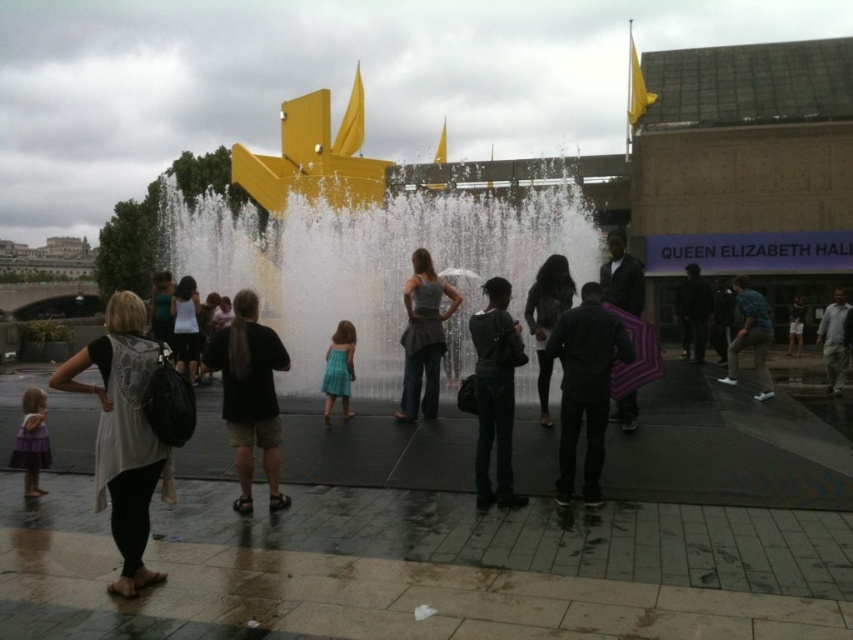
You are standing at the point marked by coordinates point (236,424) in the image. A tour guide asks you to walk 10 meters towards the Queen Elizabeth Hall. Will you be able to see the fountain with the yellow sculpture from your new position?

The point (236,424) is 25.60 meters away from the viewer. After walking 10 meters towards the Queen Elizabeth Hall, you will be 15.6 meters away from the original position. Since the fountain with the yellow sculpture is in the foreground and the Queen Elizabeth Hall is in the background, you will still be able to see the fountain from your new position as it remains within your line of sight.

You are a photographer trying to capture both the blue plaid shirt at center and the teal satin dress at center in the same frame. Which object should you adjust your camera angle to focus on first to ensure both are in the shot?

The blue plaid shirt at center might be wider than the teal satin dress at center, so you should focus on the blue plaid shirt at center first to accommodate its width in the frame.